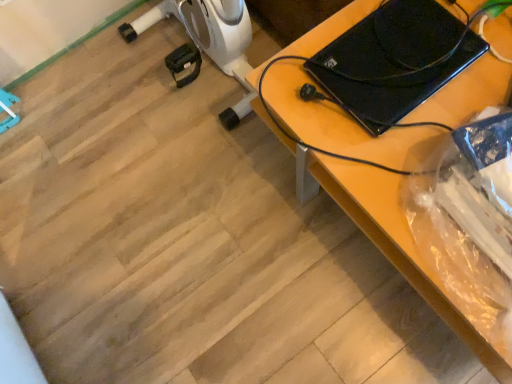
Find the location of a particular element. This screenshot has height=384, width=512. vacant position to the left of black glossy laptop at upper right is located at coordinates (305, 102).